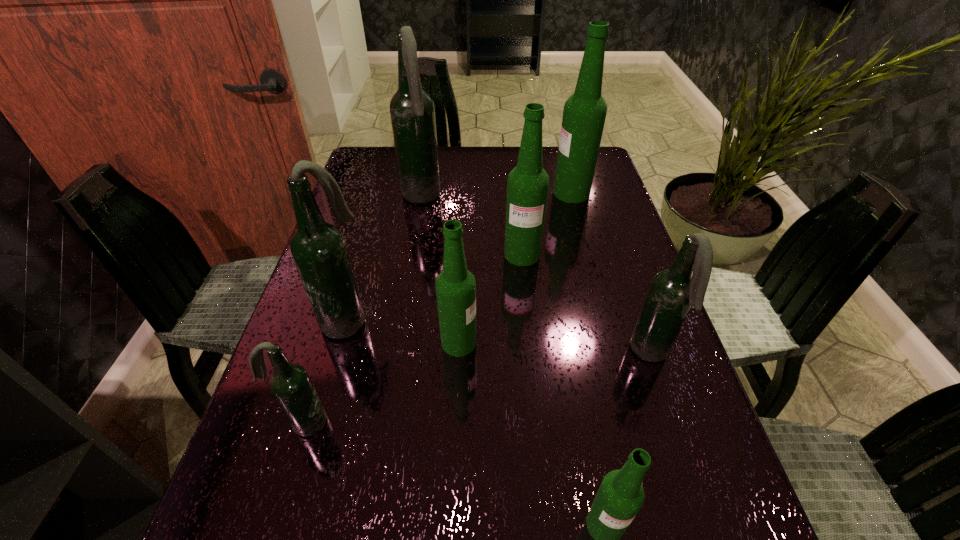
This screenshot has height=540, width=960. I want to click on vacant region located 0.130m on the back of the second nearest object, so click(326, 349).

Identify the location of object at the far left corner. (412, 111).

You are a GUI agent. You are given a task and a screenshot of the screen. Output one action in this format:
    pyautogui.click(x=<x>, y=<y>)
    Task: Click on the object present at the far right corner
    This screenshot has height=540, width=960.
    Given the screenshot: What is the action you would take?
    pyautogui.click(x=584, y=114)

This screenshot has height=540, width=960. Find the location of `vacant space at the far edge of the desktop`. vacant space at the far edge of the desktop is located at coordinates (461, 179).

At what (x,y) coordinates should I click in order to perform the action: click on vacant space at the left edge. Please return your answer as a coordinate pair (x, y). The image size is (960, 540). Looking at the image, I should click on (368, 265).

The image size is (960, 540). In the image, there is a desktop. In order to click on vacant area at the right edge in this screenshot , I will do `click(599, 278)`.

Image resolution: width=960 pixels, height=540 pixels. In order to click on vacant region at the far left corner of the desktop in this screenshot , I will do `click(359, 164)`.

This screenshot has width=960, height=540. I want to click on free spot between the farthest green beer bottle and the third farthest green beer bottle, so pyautogui.click(x=516, y=268).

Identify the location of vacant space that's between the seventh farthest beer bottle and the second smallest green beer bottle. (381, 382).

Identify the location of vacant region between the second green beer bottle from left to right and the farthest green beer bottle. (547, 224).